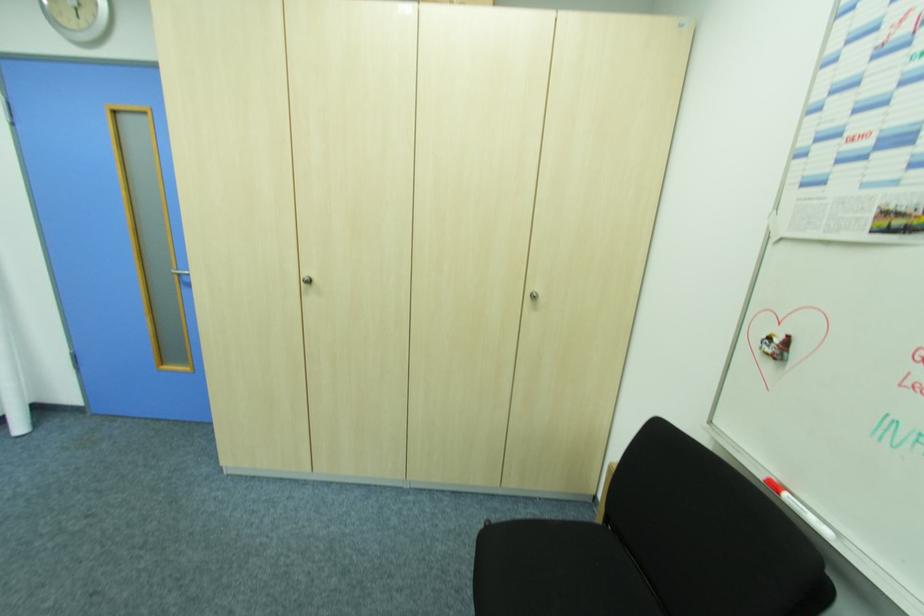
Describe the element at coordinates (579, 570) in the screenshot. I see `the chair sitting surface` at that location.